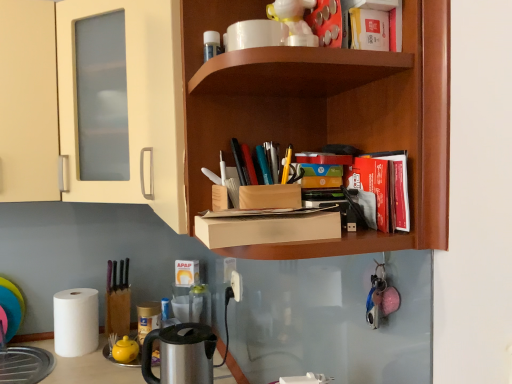
The width and height of the screenshot is (512, 384). I want to click on white glossy toy at upper center, so click(294, 21).

The height and width of the screenshot is (384, 512). What are the coordinates of `red matte book at upper right, which is the second book from top to bottom` in the screenshot? It's located at (397, 185).

The image size is (512, 384). Describe the element at coordinates (371, 185) in the screenshot. I see `red matte book at upper right, which is counted as the first book, starting from the bottom` at that location.

The image size is (512, 384). Describe the element at coordinates (181, 354) in the screenshot. I see `stainless steel kettle at lower left` at that location.

What do you see at coordinates (76, 322) in the screenshot? This screenshot has height=384, width=512. I see `white matte paper towel at lower left` at bounding box center [76, 322].

This screenshot has height=384, width=512. Find the location of `white matte paper towel at lower left`. white matte paper towel at lower left is located at coordinates (76, 322).

This screenshot has width=512, height=384. What do you see at coordinates (376, 25) in the screenshot?
I see `red matte book at upper right, the first book positioned from the top` at bounding box center [376, 25].

Where is `white glossy toy at upper center`? white glossy toy at upper center is located at coordinates (294, 21).

Considering the relative sizes of white glossy coffee cup at upper center and red matte book at upper right, placed as the 2th book when sorted from bottom to top, in the image provided, is white glossy coffee cup at upper center taller than red matte book at upper right, placed as the 2th book when sorted from bottom to top,?

No, white glossy coffee cup at upper center is not taller than red matte book at upper right, placed as the 2th book when sorted from bottom to top.

From a real-world perspective, between white glossy coffee cup at upper center and red matte book at upper right, which is the second book from top to bottom, who is vertically lower?

red matte book at upper right, which is the second book from top to bottom, from a real-world perspective.

From the image's perspective, is white glossy coffee cup at upper center on top of red matte book at upper right, which is the second book from top to bottom?

Yes, from the image's perspective, white glossy coffee cup at upper center is on top of red matte book at upper right, which is the second book from top to bottom.

Looking at their sizes, would you say white glossy coffee cup at upper center is wider or thinner than red matte book at upper right, placed as the 2th book when sorted from bottom to top?

white glossy coffee cup at upper center is wider than red matte book at upper right, placed as the 2th book when sorted from bottom to top.

Considering the relative sizes of red matte book at upper right, which is counted as the first book, starting from the bottom, and stainless steel kettle at lower left in the image provided, is red matte book at upper right, which is counted as the first book, starting from the bottom, wider than stainless steel kettle at lower left?

Incorrect, the width of red matte book at upper right, which is counted as the first book, starting from the bottom, does not surpass that of stainless steel kettle at lower left.

Which is correct: red matte book at upper right, which ranks as the third book in top-to-bottom order, is inside stainless steel kettle at lower left, or outside of it?

red matte book at upper right, which ranks as the third book in top-to-bottom order, is not inside stainless steel kettle at lower left, it's outside.

Is red matte book at upper right, which ranks as the third book in top-to-bottom order, facing towards stainless steel kettle at lower left?

No.

Is red matte book at upper right, which ranks as the third book in top-to-bottom order, at the right side of stainless steel kettle at lower left?

Indeed, red matte book at upper right, which ranks as the third book in top-to-bottom order, is positioned on the right side of stainless steel kettle at lower left.

Is wooden shelf at upper center not close to red matte book at upper right, which is counted as the first book, starting from the bottom?

Actually, wooden shelf at upper center and red matte book at upper right, which is counted as the first book, starting from the bottom, are a little close together.

Is the depth of wooden shelf at upper center less than that of red matte book at upper right, which is counted as the first book, starting from the bottom?

No, the depth of wooden shelf at upper center is greater than that of red matte book at upper right, which is counted as the first book, starting from the bottom.

From a real-world perspective, is wooden shelf at upper center beneath red matte book at upper right, which is counted as the first book, starting from the bottom?

No.

Can you confirm if red matte book at upper right, the first book positioned from the top, is taller than red matte book at upper right, which ranks as the third book in top-to-bottom order?

Incorrect, the height of red matte book at upper right, the first book positioned from the top, is not larger of that of red matte book at upper right, which ranks as the third book in top-to-bottom order.

Consider the image. Can you confirm if red matte book at upper right, acting as the 3th book starting from the bottom, is thinner than red matte book at upper right, which is counted as the first book, starting from the bottom?

Incorrect, the width of red matte book at upper right, acting as the 3th book starting from the bottom, is not less than that of red matte book at upper right, which is counted as the first book, starting from the bottom.

Can red matte book at upper right, which is counted as the first book, starting from the bottom, be found inside red matte book at upper right, acting as the 3th book starting from the bottom?

Definitely not — red matte book at upper right, which is counted as the first book, starting from the bottom, is not inside red matte book at upper right, acting as the 3th book starting from the bottom.

Is red matte book at upper right, the first book positioned from the top, positioned in front of red matte book at upper right, which ranks as the third book in top-to-bottom order?

Yes, red matte book at upper right, the first book positioned from the top, is in front of red matte book at upper right, which ranks as the third book in top-to-bottom order.

Between red matte book at upper right, which is counted as the first book, starting from the bottom, and white plastic electric outlet at lower center, which one has more height?

red matte book at upper right, which is counted as the first book, starting from the bottom, is taller.

From a real-world perspective, is red matte book at upper right, which is counted as the first book, starting from the bottom, located beneath white plastic electric outlet at lower center?

No, from a real-world perspective, red matte book at upper right, which is counted as the first book, starting from the bottom, is not below white plastic electric outlet at lower center.

Between white glossy coffee cup at upper center and white plastic electric outlet at lower center, which one appears on the left side from the viewer's perspective?

Positioned to the left is white plastic electric outlet at lower center.

Looking at this image, which is closer, (257, 30) or (233, 274)?

Point (257, 30) is closer to the camera than point (233, 274).

In terms of width, does white glossy coffee cup at upper center look wider or thinner when compared to white plastic electric outlet at lower center?

Considering their sizes, white glossy coffee cup at upper center looks broader than white plastic electric outlet at lower center.

Is the position of white glossy toy at upper center less distant than that of white matte paper towel at lower left?

Yes, it is in front of white matte paper towel at lower left.

Can you confirm if white glossy toy at upper center is positioned to the left of white matte paper towel at lower left?

No.

Which point is more forward, (312,33) or (59,306)?

The point (312,33) is more forward.

Identify the location of coffee cup above the red matte book at upper right, which is the second book from top to bottom (from the image's perspective). (255, 34).

Locate an element on the screen. This screenshot has width=512, height=384. appliance behind the red matte book at upper right, which is counted as the first book, starting from the bottom is located at coordinates (181, 354).

From the image, which object appears to be farther from red matte book at upper right, placed as the 2th book when sorted from bottom to top, stainless steel kettle at lower left or white glossy toy at upper center?

Based on the image, stainless steel kettle at lower left appears to be further to red matte book at upper right, placed as the 2th book when sorted from bottom to top.

Looking at the image, which one is located further to white matte paper towel at lower left, stainless steel kettle at lower left or red matte book at upper right, placed as the 2th book when sorted from bottom to top?

Based on the image, red matte book at upper right, placed as the 2th book when sorted from bottom to top, appears to be further to white matte paper towel at lower left.

Estimate the real-world distances between objects in this image. Which object is further from white glossy coffee cup at upper center, white matte paper towel at lower left or white plastic electric outlet at lower center?

The object further to white glossy coffee cup at upper center is white matte paper towel at lower left.

Which object lies nearer to the anchor point red matte book at upper right, which ranks as the third book in top-to-bottom order, white matte paper towel at lower left or stainless steel kettle at lower left?

stainless steel kettle at lower left is positioned closer to the anchor red matte book at upper right, which ranks as the third book in top-to-bottom order.

From the image, which object appears to be farther from wooden shelf at upper center, white plastic electric outlet at lower center or red matte book at upper right, which ranks as the third book in top-to-bottom order?

Based on the image, white plastic electric outlet at lower center appears to be further to wooden shelf at upper center.

Considering their positions, is white matte paper towel at lower left positioned closer to red matte book at upper right, acting as the 3th book starting from the bottom, than white plastic electric outlet at lower center?

Among the two, white plastic electric outlet at lower center is located nearer to red matte book at upper right, acting as the 3th book starting from the bottom.

Which object lies nearer to the anchor point red matte book at upper right, placed as the 2th book when sorted from bottom to top, white matte paper towel at lower left or red matte book at upper right, which is counted as the first book, starting from the bottom?

Among the two, red matte book at upper right, which is counted as the first book, starting from the bottom, is located nearer to red matte book at upper right, placed as the 2th book when sorted from bottom to top.

Based on the photo, estimate the real-world distances between objects in this image. Which object is closer to white plastic electric outlet at lower center, stainless steel kettle at lower left or white matte paper towel at lower left?

stainless steel kettle at lower left lies closer to white plastic electric outlet at lower center than the other object.

Image resolution: width=512 pixels, height=384 pixels. In order to click on appliance between wooden shelf at upper center and white matte paper towel at lower left in the front-back direction in this screenshot , I will do `click(181, 354)`.

Identify the location of appliance located between white glossy coffee cup at upper center and white matte paper towel at lower left in the depth direction. The image size is (512, 384). (181, 354).

The height and width of the screenshot is (384, 512). I want to click on electric outlet between white glossy toy at upper center and white matte paper towel at lower left in the front-back direction, so click(x=237, y=285).

Locate an element on the screen. The image size is (512, 384). appliance between white matte paper towel at lower left and white plastic electric outlet at lower center is located at coordinates tap(181, 354).